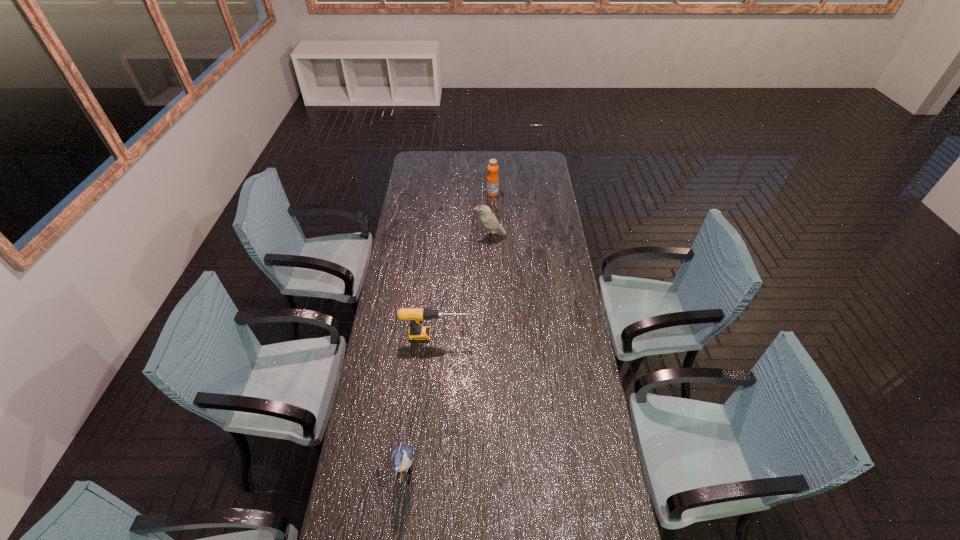
What are the coordinates of `vacant space that's between the second farthest object and the left bird` in the screenshot? It's located at (447, 355).

Choose which object is the third nearest neighbor to the nearest object. Please provide its 2D coordinates. Your answer should be formatted as a tuple, i.e. [(x, y)], where the tuple contains the x and y coordinates of a point satisfying the conditions above.

[(492, 178)]

Locate an element on the screen. object that is the closest to the left bird is located at coordinates (416, 315).

The image size is (960, 540). I want to click on the second closest bird relative to the farthest object, so click(402, 456).

Find the location of `free space that satisfies the following two spatial constraints: 1. on the front side of the fruit juice; 2. on the handle side of the drill`. free space that satisfies the following two spatial constraints: 1. on the front side of the fruit juice; 2. on the handle side of the drill is located at coordinates (497, 335).

The image size is (960, 540). I want to click on free space that satisfies the following two spatial constraints: 1. on the front side of the farthest object; 2. on the handle side of the drill, so click(x=497, y=335).